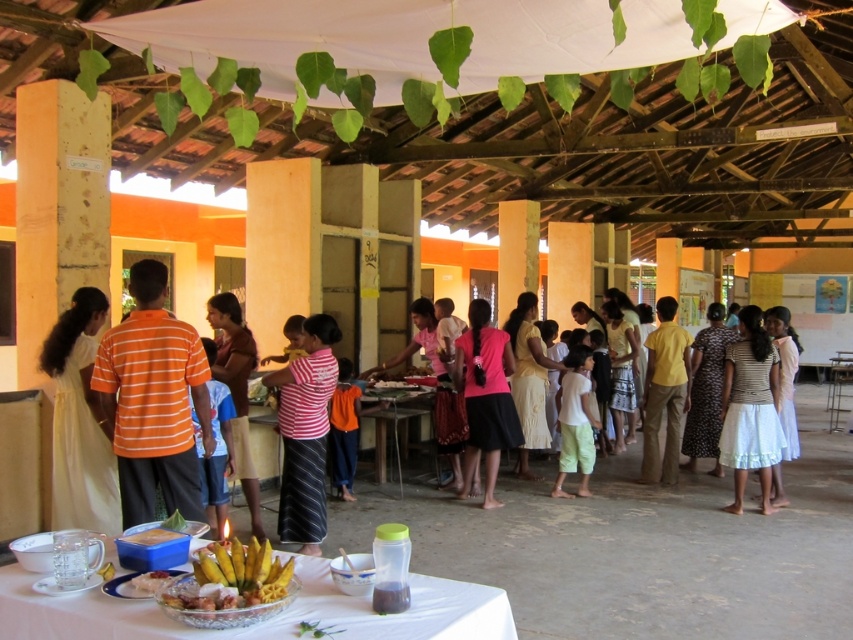
Does point (320, 477) come behind point (378, 420)?

No, it is not.

Describe the element at coordinates (305, 433) in the screenshot. I see `striped fabric skirt at center` at that location.

Is point (305, 444) farther from camera compared to point (376, 468)?

No, it is not.

You are a GUI agent. You are given a task and a screenshot of the screen. Output one action in this format:
    pyautogui.click(x=<x>, y=<y>)
    Task: Click on the striped fabric skirt at center
    
    Given the screenshot: What is the action you would take?
    pyautogui.click(x=305, y=433)

Between clear glass bowl at center and metallic silver table at center, which one has less height?

With less height is clear glass bowl at center.

Where is `clear glass bowl at center`? Image resolution: width=853 pixels, height=640 pixels. clear glass bowl at center is located at coordinates (267, 618).

Is point (22, 625) closer to camera compared to point (412, 413)?

That is True.

Where is `clear glass bowl at center`? The height and width of the screenshot is (640, 853). clear glass bowl at center is located at coordinates (267, 618).

How much distance is there between orange striped shirt at left and pink fabric skirt at center?

orange striped shirt at left and pink fabric skirt at center are 3.06 meters apart.

Between point (181, 500) and point (467, 460), which one is positioned in front?

Point (181, 500)

This screenshot has height=640, width=853. In order to click on orange striped shirt at left in this screenshot , I will do `click(154, 401)`.